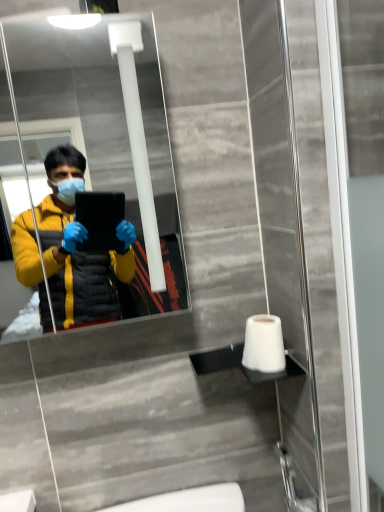
In order to click on white matte toilet paper at lower right in this screenshot , I will do `click(264, 345)`.

Measure the distance between point (55, 185) and camera.

They are 6.55 feet apart.

Identify the location of white matte toilet paper at lower right. The height and width of the screenshot is (512, 384). (264, 345).

Is there a large distance between transparent glass screen door at right and matte black mirror at upper center?

Yes.

Can you confirm if transparent glass screen door at right is bigger than matte black mirror at upper center?

No, transparent glass screen door at right is not bigger than matte black mirror at upper center.

Considering the relative sizes of transparent glass screen door at right and matte black mirror at upper center in the image provided, is transparent glass screen door at right taller than matte black mirror at upper center?

Yes.

Is transparent glass screen door at right inside or outside of matte black mirror at upper center?

transparent glass screen door at right is outside matte black mirror at upper center.

From a real-world perspective, between matte black mirror at upper center and transparent glass screen door at right, who is vertically higher?

matte black mirror at upper center.

Considering the relative sizes of matte black mirror at upper center and transparent glass screen door at right in the image provided, is matte black mirror at upper center shorter than transparent glass screen door at right?

Yes.

Between point (19, 63) and point (323, 10), which one is positioned behind?

Positioned behind is point (19, 63).

From the image's perspective, is matte black mirror at upper center under transparent glass screen door at right?

No, from the image's perspective, matte black mirror at upper center is not below transparent glass screen door at right.

Can you confirm if white matte toilet paper at lower right is wider than transparent glass screen door at right?

Yes, white matte toilet paper at lower right is wider than transparent glass screen door at right.

From the image's perspective, is white matte toilet paper at lower right over transparent glass screen door at right?

No, from the image's perspective, white matte toilet paper at lower right is not over transparent glass screen door at right.

From the picture: Is white matte toilet paper at lower right inside or outside of transparent glass screen door at right?

white matte toilet paper at lower right lies outside transparent glass screen door at right.

Between white matte toilet paper at lower right and transparent glass screen door at right, which one appears on the left side from the viewer's perspective?

Positioned to the left is white matte toilet paper at lower right.

Is white matte toilet paper at lower right further to the viewer compared to matte black mirror at upper center?

Yes, white matte toilet paper at lower right is behind matte black mirror at upper center.

Does point (252, 364) appear closer or farther from the camera than point (185, 303)?

Point (252, 364) appears to be closer to the viewer than point (185, 303).

Is white matte toilet paper at lower right wider or thinner than matte black mirror at upper center?

Clearly, white matte toilet paper at lower right has less width compared to matte black mirror at upper center.

Is there a large distance between matte black mirror at upper center and white matte toilet paper at lower right?

That's right, there is a large distance between matte black mirror at upper center and white matte toilet paper at lower right.

Considering the sizes of objects matte black mirror at upper center and white matte toilet paper at lower right in the image provided, who is thinner, matte black mirror at upper center or white matte toilet paper at lower right?

With smaller width is white matte toilet paper at lower right.

From a real-world perspective, does matte black mirror at upper center stand above white matte toilet paper at lower right?

Indeed, from a real-world perspective, matte black mirror at upper center stands above white matte toilet paper at lower right.

Looking at this image, from the image's perspective, is transparent glass screen door at right on top of white matte toilet paper at lower right?

Yes.

Looking at this image, how distant is transparent glass screen door at right from white matte toilet paper at lower right?

transparent glass screen door at right and white matte toilet paper at lower right are 11.07 inches apart from each other.

Which is closer, (324,14) or (256,338)?

Point (324,14).

Can white matte toilet paper at lower right be found inside transparent glass screen door at right?

No, white matte toilet paper at lower right is not inside transparent glass screen door at right.

This screenshot has height=512, width=384. Find the location of `mirror lying on the left of transparent glass screen door at right`. mirror lying on the left of transparent glass screen door at right is located at coordinates (99, 158).

The image size is (384, 512). In order to click on mirror that is above the transparent glass screen door at right (from a real-world perspective) in this screenshot , I will do `click(99, 158)`.

Based on their spatial positions, is transparent glass screen door at right or white matte toilet paper at lower right closer to matte black mirror at upper center?

The object closer to matte black mirror at upper center is white matte toilet paper at lower right.

When comparing their distances from transparent glass screen door at right, does matte black mirror at upper center or white matte toilet paper at lower right seem further?

Among the two, matte black mirror at upper center is located further to transparent glass screen door at right.

Which object lies nearer to the anchor point matte black mirror at upper center, white matte toilet paper at lower right or transparent glass screen door at right?

Among the two, white matte toilet paper at lower right is located nearer to matte black mirror at upper center.

When comparing their distances from transparent glass screen door at right, does white matte toilet paper at lower right or matte black mirror at upper center seem further?

The object further to transparent glass screen door at right is matte black mirror at upper center.

Based on their spatial positions, is transparent glass screen door at right or matte black mirror at upper center closer to white matte toilet paper at lower right?

Answer: transparent glass screen door at right lies closer to white matte toilet paper at lower right than the other object.

Based on their spatial positions, is matte black mirror at upper center or transparent glass screen door at right closer to white matte toilet paper at lower right?

transparent glass screen door at right lies closer to white matte toilet paper at lower right than the other object.

Image resolution: width=384 pixels, height=512 pixels. Find the location of `toilet paper between matte black mirror at upper center and transparent glass screen door at right`. toilet paper between matte black mirror at upper center and transparent glass screen door at right is located at coordinates (264, 345).